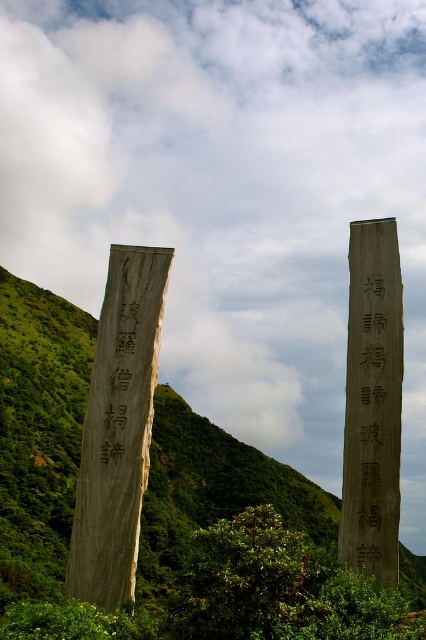
Question: Can you confirm if green wood hillside at center is positioned to the right of black wood sign at left?

Choices:
 (A) yes
 (B) no

Answer: (B)

Question: Is green wood hillside at center further to camera compared to smooth gray stone monument at right?

Choices:
 (A) yes
 (B) no

Answer: (B)

Question: Is green wood hillside at center wider than wooden signpost at center-right?

Choices:
 (A) yes
 (B) no

Answer: (A)

Question: Considering the real-world distances, which object is closest to the green wood hillside at center?

Choices:
 (A) smooth gray stone monument at right
 (B) wooden signpost at left

Answer: (B)

Question: Which is farther from the smooth gray stone monument at right?

Choices:
 (A) wooden signpost at center-right
 (B) green wood hillside at center
 (C) wooden signpost at left

Answer: (B)

Question: Which point is closer to the camera?

Choices:
 (A) (383, 531)
 (B) (103, 385)
 (C) (124, 275)

Answer: (A)